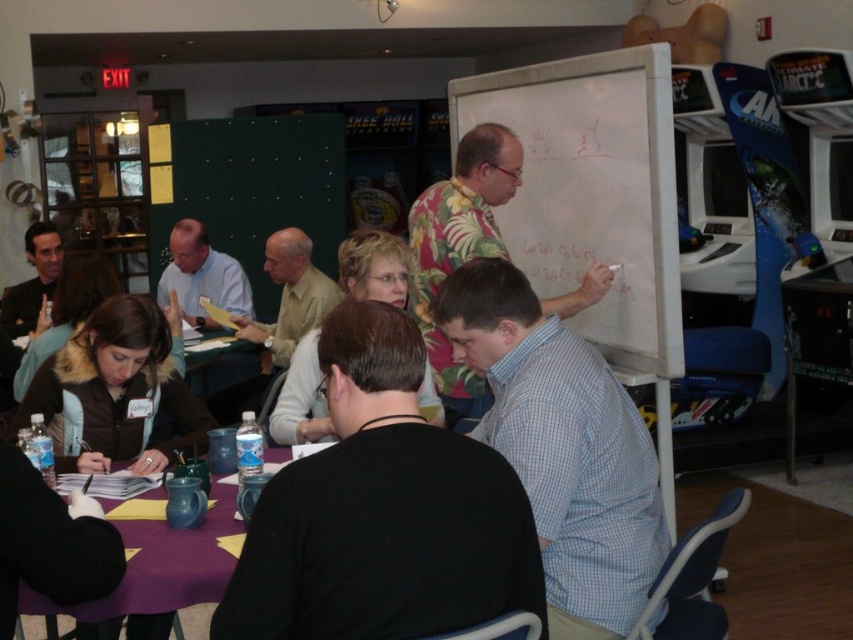
You are a person who needs to place a 15 cm tall book on the purple fabric table at lower center. Considering the height of the light brown shirt at center, will the book be visible to someone sitting at the table?

The purple fabric table at lower center is not as tall as the light brown shirt at center. Since the book is 15 cm tall, if the table is shorter than the shirt, the book might be partially visible depending on the shirt wearer sitting upright. However, the exact visibility isn

You are a delivery person holding a box that is 1.5 meters long. You need to place it on the purple fabric table at lower center. Can you fit the box on the table without it hanging off the edge? Please explain your reasoning.

The distance between the purple fabric table at lower center and the viewer is 1.54 meters, but this measurement does not provide information about the table dimensions. Therefore, it is unclear if the 1.5 meter long box will fit on the table.